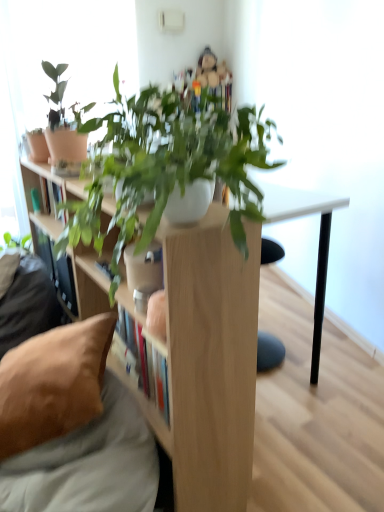
Question: Which is correct: wooden bookshelf at left, the second shelf viewed from the right, is inside brown fabric pillow at lower left, or outside of it?

Choices:
 (A) inside
 (B) outside

Answer: (B)

Question: Based on their sizes in the image, would you say wooden bookshelf at left, the second shelf viewed from the right, is bigger or smaller than brown fabric pillow at lower left?

Choices:
 (A) small
 (B) big

Answer: (A)

Question: Considering the real-world distances, which object is farthest from the matte white flowerpot at upper left?

Choices:
 (A) wooden bookshelf at left, the second shelf viewed from the right
 (B) light wood shelf at center, positioned as the first shelf in right-to-left order
 (C) matte clay pot at upper left
 (D) brown fabric couch at lower left
 (E) brown fabric pillow at lower left

Answer: (D)

Question: Which object is the farthest from the wooden bookshelf at left, which appears as the 1th shelf when viewed from the left?

Choices:
 (A) brown fabric couch at lower left
 (B) brown fabric pillow at lower left
 (C) matte white flowerpot at upper left
 (D) light wood shelf at center, placed as the 2th shelf when sorted from left to right
 (E) matte clay pot at upper left

Answer: (A)